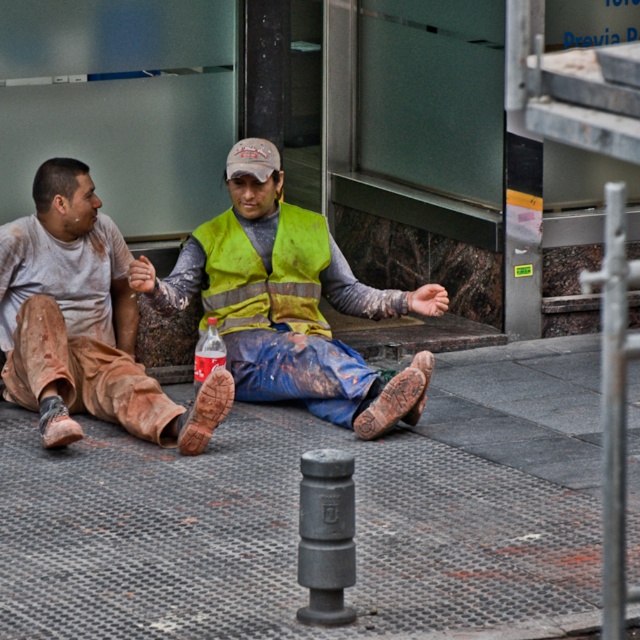
Question: Is gray rubber mat at center further to camera compared to green reflective safety vest at center?

Choices:
 (A) no
 (B) yes

Answer: (A)

Question: Which of the following is the closest to the observer?

Choices:
 (A) gray rubber mat at center
 (B) yellow reflective vest at center
 (C) dirty brown pants at left

Answer: (A)

Question: Which point is farther to the camera?

Choices:
 (A) (316, 228)
 (B) (400, 374)
 (C) (172, 529)

Answer: (A)

Question: Can you confirm if gray rubber mat at center is positioned below yellow reflective vest at center?

Choices:
 (A) yes
 (B) no

Answer: (A)

Question: Observing the image, what is the correct spatial positioning of dirty brown pants at left in reference to green reflective safety vest at center?

Choices:
 (A) left
 (B) right

Answer: (A)

Question: Which object is the closest to the gray rubber mat at center?

Choices:
 (A) green reflective safety vest at center
 (B) dirty brown pants at left
 (C) yellow reflective vest at center

Answer: (C)